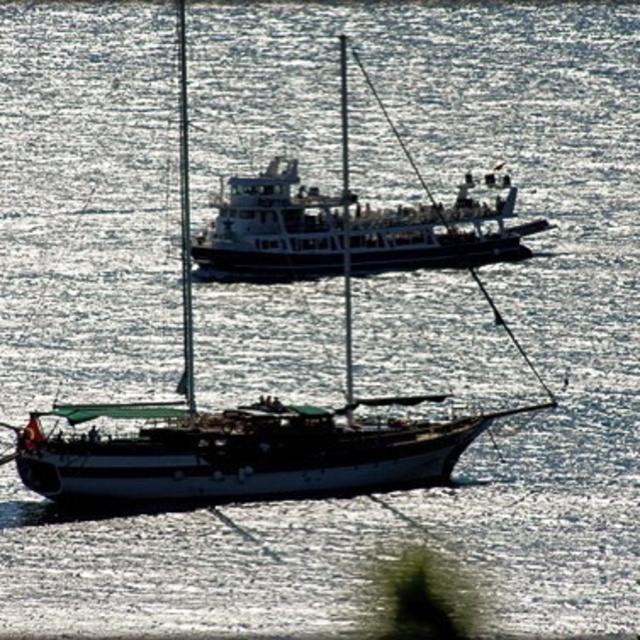
Does white matte sailboat at lower center have a greater height compared to white matte boat at center?

Yes, white matte sailboat at lower center is taller than white matte boat at center.

Can you confirm if white matte sailboat at lower center is positioned to the right of white matte boat at center?

No, white matte sailboat at lower center is not to the right of white matte boat at center.

Between point (380, 250) and point (300, 193), which one is positioned in front?

Point (380, 250) is in front.

Where is `white matte sailboat at lower center`? The height and width of the screenshot is (640, 640). white matte sailboat at lower center is located at coordinates (275, 396).